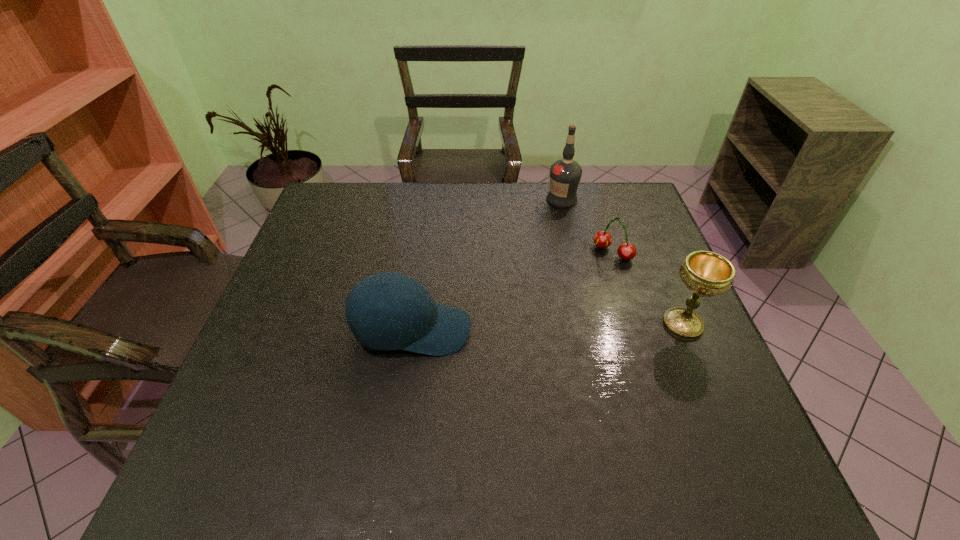
Find the location of a particular element. The height and width of the screenshot is (540, 960). the leftmost object is located at coordinates (419, 325).

At what (x,y) coordinates should I click in order to perform the action: click on the third tallest object. Please return your answer as a coordinate pair (x, y). This screenshot has width=960, height=540. Looking at the image, I should click on (419, 325).

Image resolution: width=960 pixels, height=540 pixels. Find the location of `the rightmost object`. the rightmost object is located at coordinates (705, 273).

This screenshot has height=540, width=960. In order to click on the second tallest object in this screenshot , I will do `click(705, 273)`.

At what (x,y) coordinates should I click in order to perform the action: click on the second farthest object. Please return your answer as a coordinate pair (x, y). The height and width of the screenshot is (540, 960). Looking at the image, I should click on (626, 251).

The height and width of the screenshot is (540, 960). Find the location of `the second object from right to left`. the second object from right to left is located at coordinates (626, 251).

The height and width of the screenshot is (540, 960). In order to click on the farthest object in this screenshot , I will do `click(565, 174)`.

The image size is (960, 540). In order to click on the second object from left to right in this screenshot , I will do `click(565, 174)`.

Where is `blank space located on the front-facing side of the baseball cap`? The image size is (960, 540). blank space located on the front-facing side of the baseball cap is located at coordinates (580, 330).

Locate an element on the screen. vacant region located on the front of the chalice is located at coordinates (705, 375).